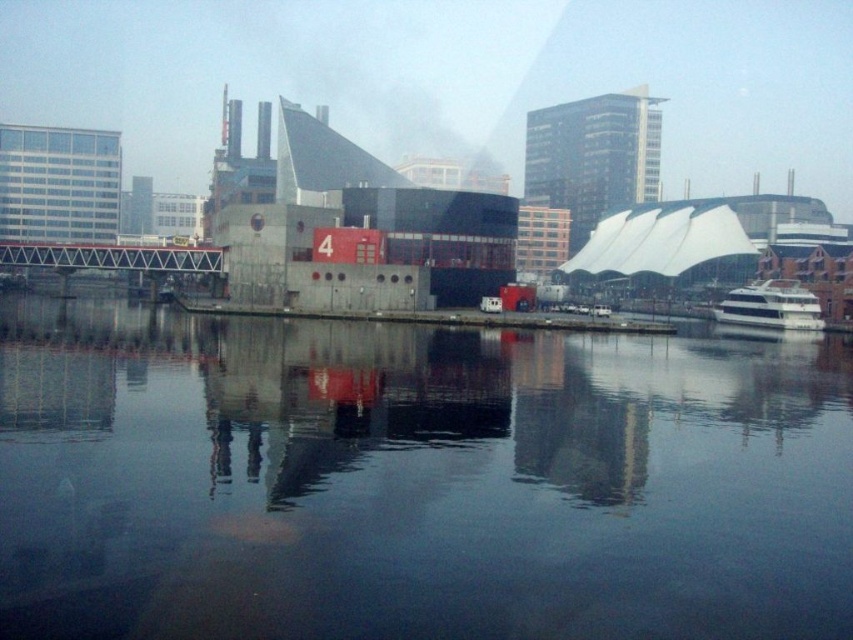
You are a photographer trying to capture the reflection of the white glossy boat at right in the transparent glass water at center. Based on the scene description, will the boat fit entirely within the water area in your photo?

The transparent glass water at center has a larger width than the white glossy boat at right, so the boat will fit entirely within the water area in the photo.

You are a photographer trying to capture the reflection of the white glossy boat at right in the transparent glass water at center. Given that the water is calm, will the boat be fully reflected in the water?

The transparent glass water at center has a larger size compared to white glossy boat at right, so the boat will be fully reflected in the water as the water surface is sufficient to accommodate its reflection.